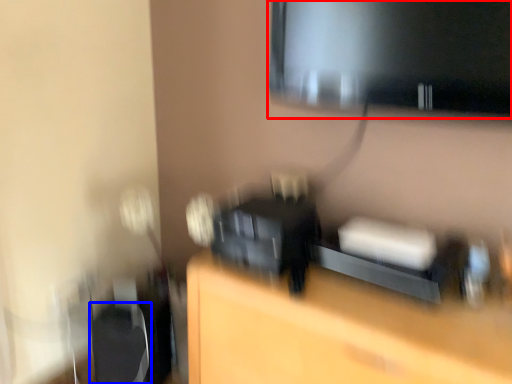
Question: Among these objects, which one is nearest to the camera, computer monitor (highlighted by a red box) or swivel chair (highlighted by a blue box)?

Choices:
 (A) computer monitor
 (B) swivel chair

Answer: (A)